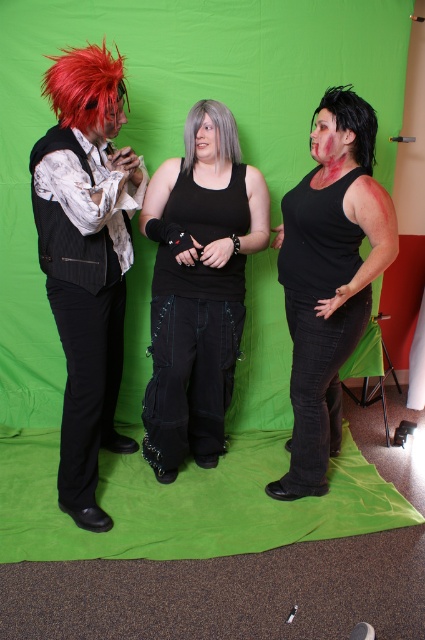
You are a costume designer working on a film scene. You need to determine the visibility of the shiny black vest at left and the black matte tank top at center in a scene where lighting is directed towards the backdrop. Which object will appear more prominent in the final shot?

The shiny black vest at left will appear more prominent because it is closer to the viewer and its reflective surface may catch more light, making it stand out compared to the black matte tank top at center which is farther away and less reflective.

You are a costume designer preparing for a photoshoot. You need to ensure that the shiny black vest at left and the black matte tank top at center are visible against the green backdrop. Which of these two items will stand out more in the image?

The shiny black vest at left will stand out more because it is located above the black matte tank top at center, making it more prominent in the frame.